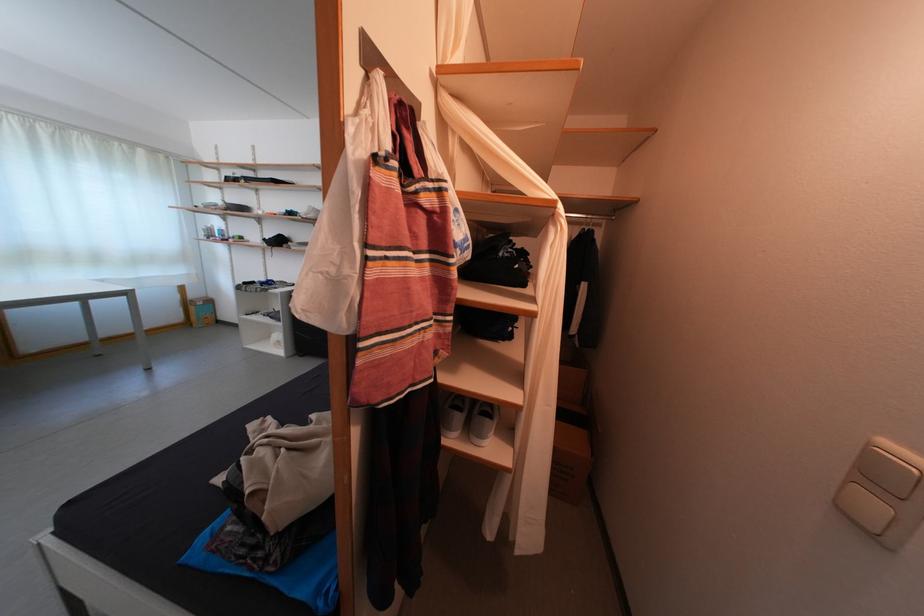
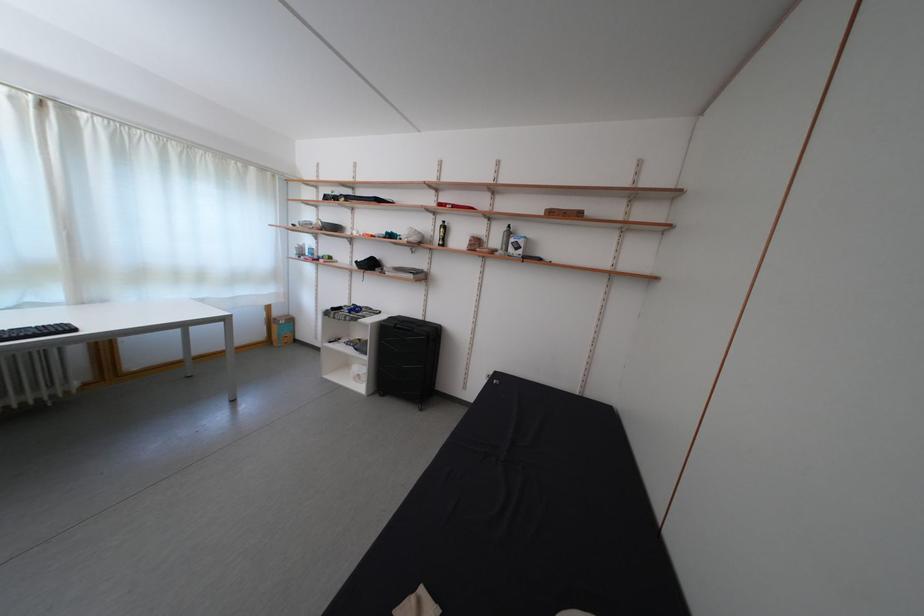
Question: How did the camera likely rotate?

Choices:
 (A) Left
 (B) Right
 (C) Up
 (D) Down

Answer: (A)